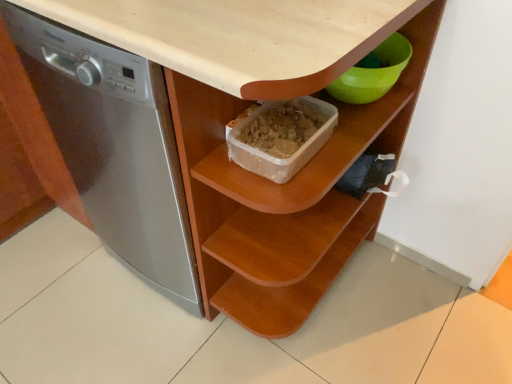
This screenshot has height=384, width=512. What are the coordinates of `vacant space in front of satin silver dishwasher at left` in the screenshot? It's located at (160, 347).